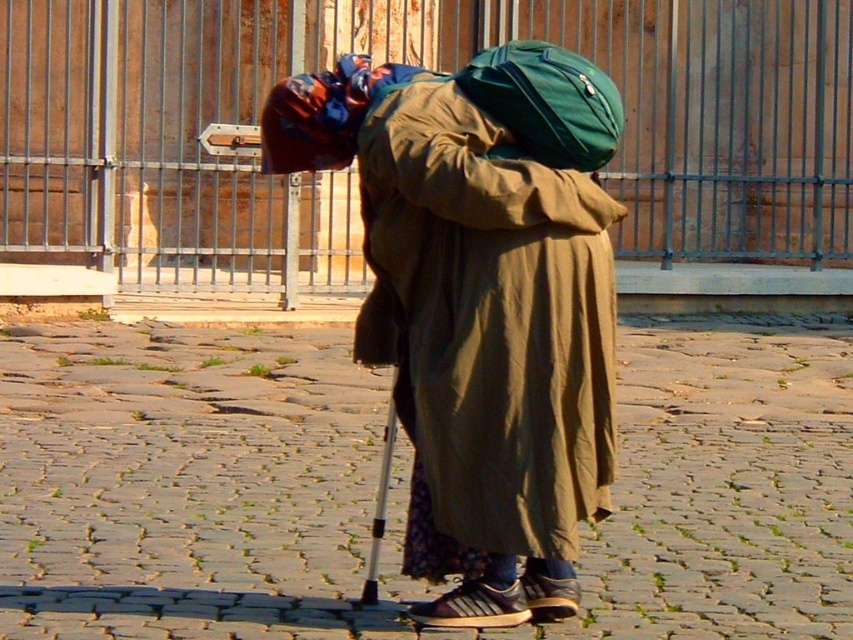
You are a delivery person who needs to place a package on the ground. The package is as wide as the green fabric backpack at center. Can you safely place it on the brown cobblestone at center without it hanging over the edge?

The brown cobblestone at center might be wider than the green fabric backpack at center, so there is a possibility that the package will fit. However, since the width comparison is uncertain, it is safer to check the actual dimensions before placing the package.